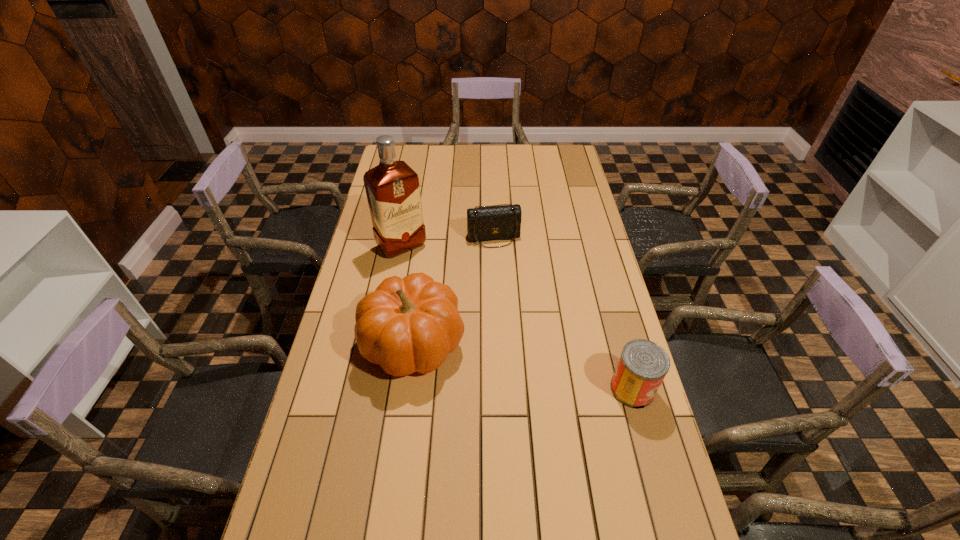
Locate an element on the screen. The image size is (960, 540). blank region between the rightmost object and the clutch bag is located at coordinates (563, 314).

In order to click on free space between the tallest object and the rightmost object in this screenshot , I will do `click(517, 318)`.

Where is `empty space that is in between the rightmost object and the liquor`? This screenshot has width=960, height=540. empty space that is in between the rightmost object and the liquor is located at coordinates (517, 318).

At what (x,y) coordinates should I click in order to perform the action: click on unoccupied position between the rightmost object and the clutch bag. Please return your answer as a coordinate pair (x, y). Looking at the image, I should click on (563, 314).

This screenshot has width=960, height=540. What are the coordinates of `free space between the can and the second tallest object` in the screenshot? It's located at (522, 366).

Identify the location of free space between the pumpkin and the clutch bag. (453, 290).

You are a GUI agent. You are given a task and a screenshot of the screen. Output one action in this format:
    pyautogui.click(x=<x>, y=<y>)
    Task: Click on the free point between the rightmost object and the pumpkin
    The width and height of the screenshot is (960, 540).
    Given the screenshot: What is the action you would take?
    pyautogui.click(x=522, y=366)

Find the location of a particular element. vacant space that's between the clutch bag and the rightmost object is located at coordinates (563, 314).

This screenshot has height=540, width=960. I want to click on vacant space that's between the pumpkin and the shortest object, so click(x=453, y=290).

At what (x,y) coordinates should I click in order to perform the action: click on the second closest object to the shortest object. Please return your answer as a coordinate pair (x, y). Looking at the image, I should click on (410, 324).